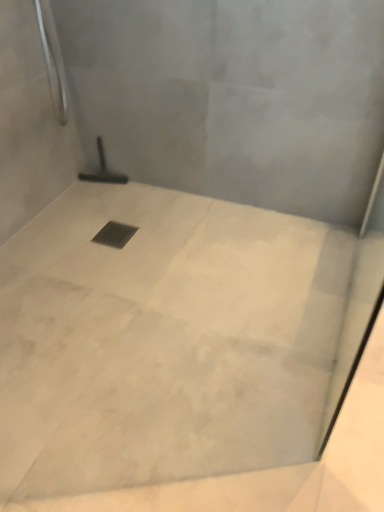
Image resolution: width=384 pixels, height=512 pixels. In order to click on vacant area on top of white marble floor at center (from a real-world perspective) in this screenshot , I will do `click(177, 328)`.